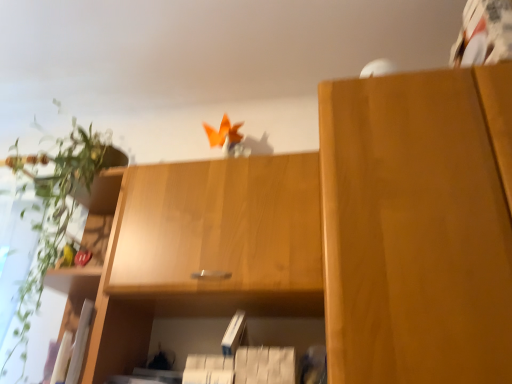
Question: Can you confirm if green leafy plant at left is shorter than white matte paperback book at center?

Choices:
 (A) no
 (B) yes

Answer: (A)

Question: Is white matte paperback book at center at the back of green leafy plant at left?

Choices:
 (A) no
 (B) yes

Answer: (A)

Question: Considering the relative sizes of green leafy plant at left and white matte paperback book at center in the image provided, is green leafy plant at left smaller than white matte paperback book at center?

Choices:
 (A) no
 (B) yes

Answer: (A)

Question: Is white matte paperback book at center surrounded by green leafy plant at left?

Choices:
 (A) no
 (B) yes

Answer: (A)

Question: Does green leafy plant at left appear on the right side of white matte paperback book at center?

Choices:
 (A) no
 (B) yes

Answer: (A)

Question: Is green leafy plant at left completely or partially outside of white matte paperback book at center?

Choices:
 (A) yes
 (B) no

Answer: (A)

Question: From a real-world perspective, is white matte paperback book at center physically above matte wood cabinet at right, acting as the first cabinetry starting from the right?

Choices:
 (A) no
 (B) yes

Answer: (A)

Question: Is white matte paperback book at center not close to matte wood cabinet at right, acting as the first cabinetry starting from the right?

Choices:
 (A) yes
 (B) no

Answer: (B)

Question: From the image's perspective, is white matte paperback book at center above matte wood cabinet at right, which ranks as the 2th cabinetry in left-to-right order?

Choices:
 (A) yes
 (B) no

Answer: (B)

Question: Is white matte paperback book at center outside matte wood cabinet at right, which ranks as the 2th cabinetry in left-to-right order?

Choices:
 (A) no
 (B) yes

Answer: (B)

Question: Does white matte paperback book at center appear on the right side of matte wood cabinet at right, which ranks as the 2th cabinetry in left-to-right order?

Choices:
 (A) no
 (B) yes

Answer: (A)

Question: From a real-world perspective, is white matte paperback book at center beneath matte wood cabinet at right, which ranks as the 2th cabinetry in left-to-right order?

Choices:
 (A) no
 (B) yes

Answer: (B)

Question: Is matte wood cabinet at right, which ranks as the 2th cabinetry in left-to-right order, bigger than white matte paperback book at center?

Choices:
 (A) no
 (B) yes

Answer: (B)